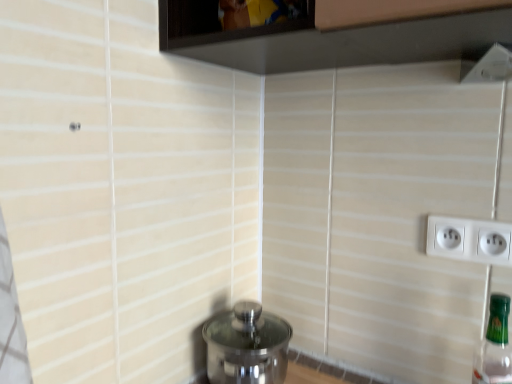
Question: In the image, is polished stainless steel water heater at lower center on the left side or the right side of transparent glass window at upper center?

Choices:
 (A) left
 (B) right

Answer: (A)

Question: Considering the positions of point (281, 317) and point (288, 18), is point (281, 317) closer or farther from the camera than point (288, 18)?

Choices:
 (A) closer
 (B) farther

Answer: (B)

Question: Which is nearer to the transparent glass window at upper center?

Choices:
 (A) green glass bottle at right
 (B) white plastic power plugs and sockets at right
 (C) polished stainless steel water heater at lower center

Answer: (B)

Question: Which is nearer to the white plastic power plugs and sockets at right?

Choices:
 (A) green glass bottle at right
 (B) transparent glass window at upper center
 (C) polished stainless steel water heater at lower center

Answer: (A)